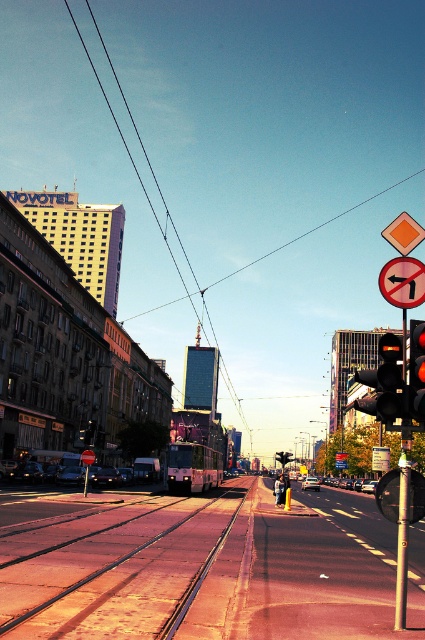
Question: Does metallic pole at right appear on the left side of red glass traffic light at right?

Choices:
 (A) no
 (B) yes

Answer: (A)

Question: Among these objects, which one is nearest to the camera?

Choices:
 (A) metallic pole at right
 (B) black wire at upper center

Answer: (A)

Question: Based on their relative distances, which object is nearer to the red glass traffic light at right?

Choices:
 (A) red plastic sign at upper right
 (B) black wire at upper center

Answer: (A)

Question: Which of the following is the closest to the observer?

Choices:
 (A) red plastic sign at upper right
 (B) black wire at upper center
 (C) metallic pole at right

Answer: (C)

Question: From the image, what is the correct spatial relationship of metallic tram tracks at center in relation to red glass traffic light at right?

Choices:
 (A) left
 (B) right

Answer: (A)

Question: Can you confirm if metallic pole at right is smaller than red plastic sign at upper right?

Choices:
 (A) yes
 (B) no

Answer: (A)